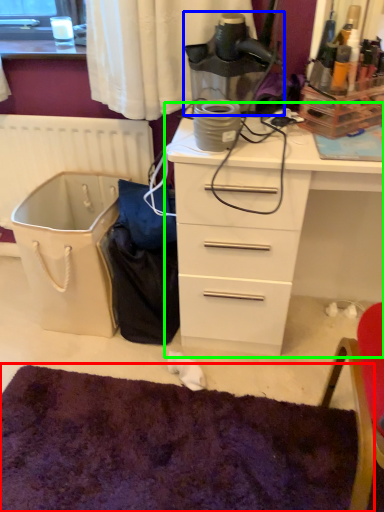
Question: Estimate the real-world distances between objects in this image. Which object is farther from mat (highlighted by a red box), appliance (highlighted by a blue box) or chest of drawers (highlighted by a green box)?

Choices:
 (A) appliance
 (B) chest of drawers

Answer: (A)